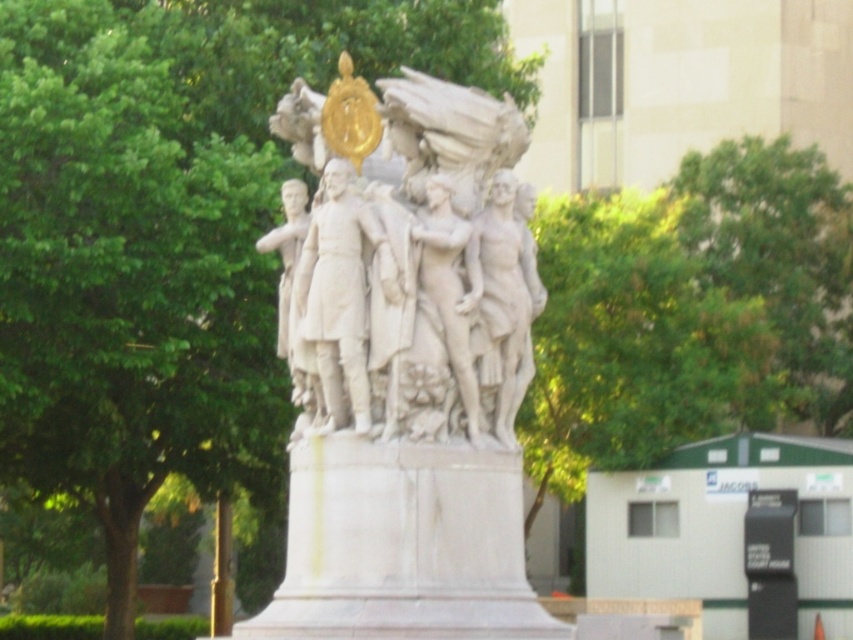
You are an art student standing in front of the monument and want to sketch the scene. Which object, the white marble statue at center or the green leafy tree at upper center, should you focus on first to capture their relative positions accurately?

You should focus on the white marble statue at center first because it is closer to the viewer than the green leafy tree at upper center, so its position should be established before the tree to maintain spatial accuracy.

You are an art student analyzing the monument. You notice the white marble statue at center and the green leafy tree at upper center. Which object appears larger in the image?

The green leafy tree at upper center is larger than the white marble statue at center.